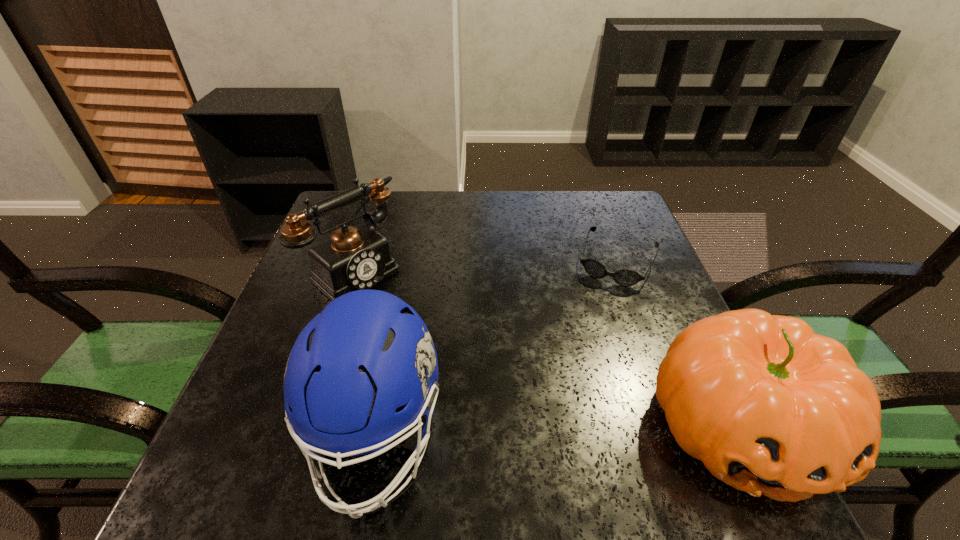
Identify the location of free space on the desktop that is between the football helmet and the pumpkin and is positioned on the lenses of the sunglasses. This screenshot has height=540, width=960. (551, 431).

This screenshot has width=960, height=540. I want to click on vacant spot on the desktop that is between the football helmet and the pumpkin and is positioned on the front of the telephone at the rotary dial, so click(x=555, y=431).